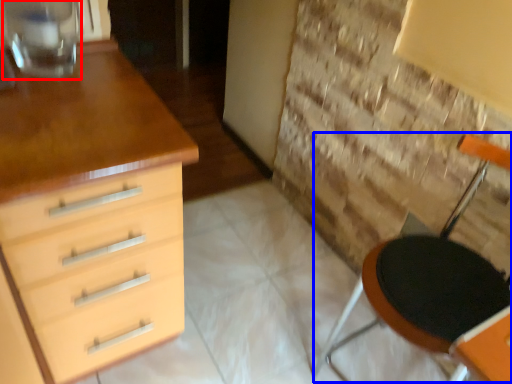
Question: Which object appears farthest to the camera in this image, glass vase (highlighted by a red box) or armchair (highlighted by a blue box)?

Choices:
 (A) glass vase
 (B) armchair

Answer: (A)